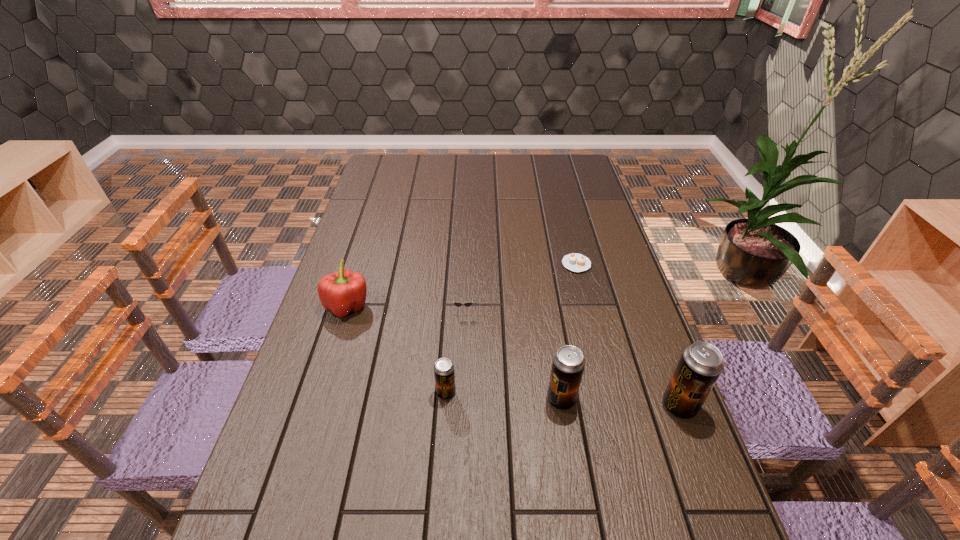
The image size is (960, 540). Identify the location of free space for a new beer can on the left. (334, 386).